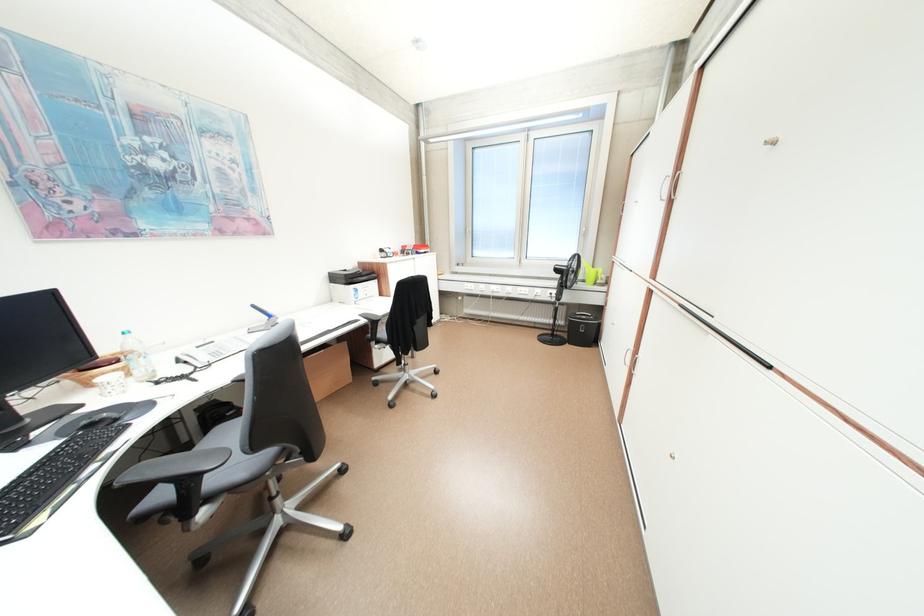
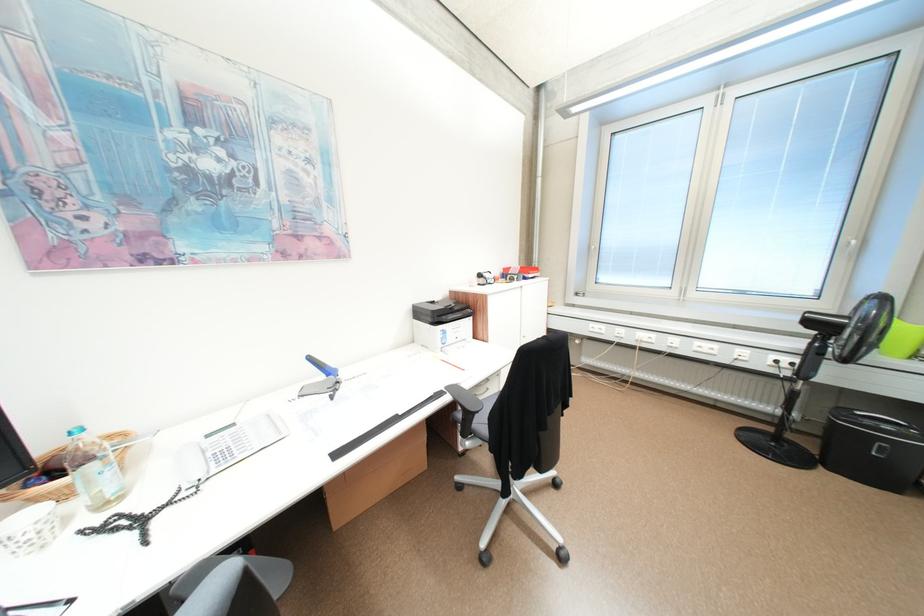
Locate, in the second image, the point that corresponds to pixel 225 354 in the first image.

(231, 456)